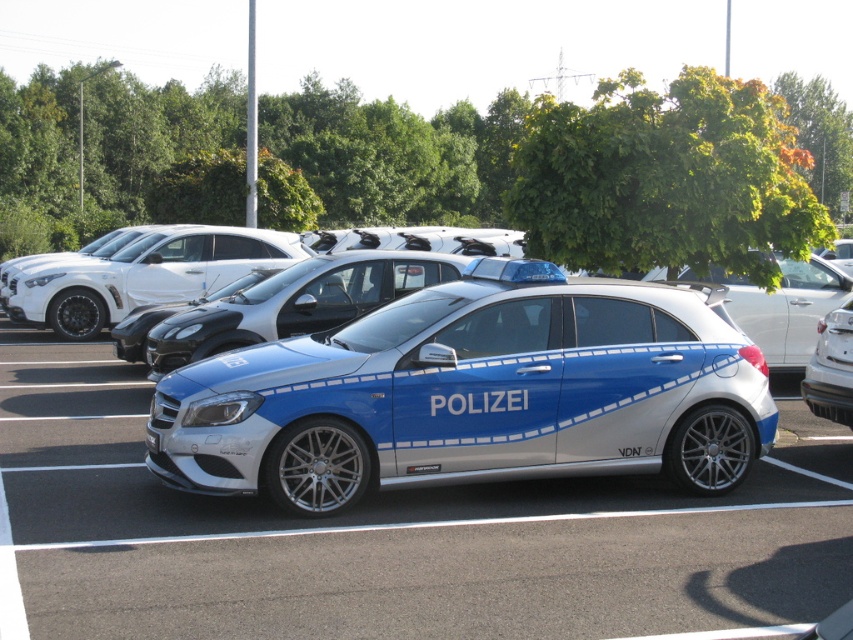
You are a delivery driver who needs to park your truck between the white glossy sedan at center and the black rubber line at lower center. Your truck is 8 meters long. Can you fit your truck between them without overlapping either the sedan or the line?

The distance between the white glossy sedan at center and the black rubber line at lower center is 9.85 meters. Since your truck is 8 meters long, there is enough space to park between them without overlapping either object.